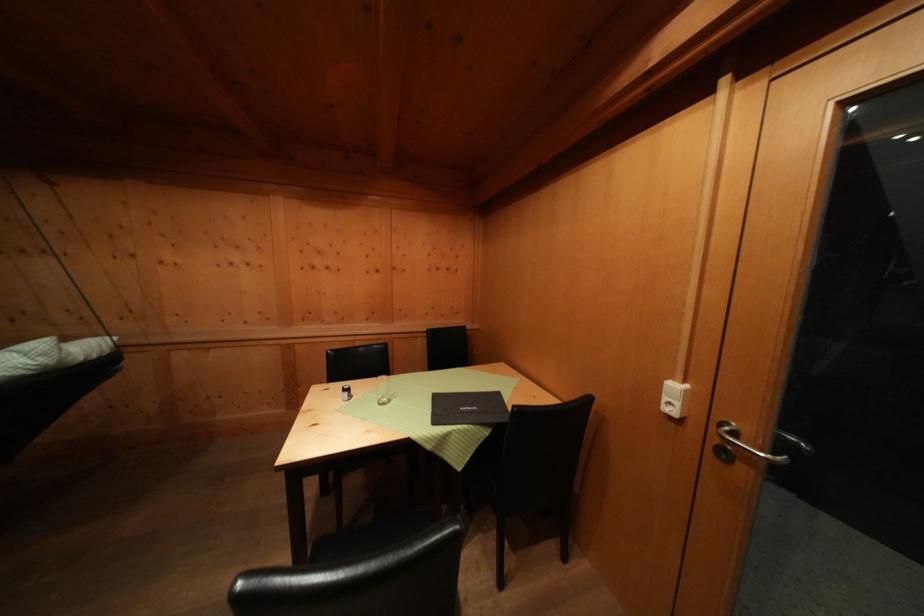
What do you see at coordinates (744, 445) in the screenshot? The width and height of the screenshot is (924, 616). I see `the silver door handle` at bounding box center [744, 445].